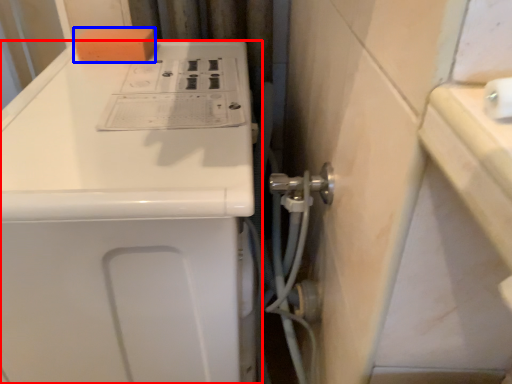
Question: Which of the following is the closest to the observer, home appliance (highlighted by a red box) or soap (highlighted by a blue box)?

Choices:
 (A) home appliance
 (B) soap

Answer: (A)